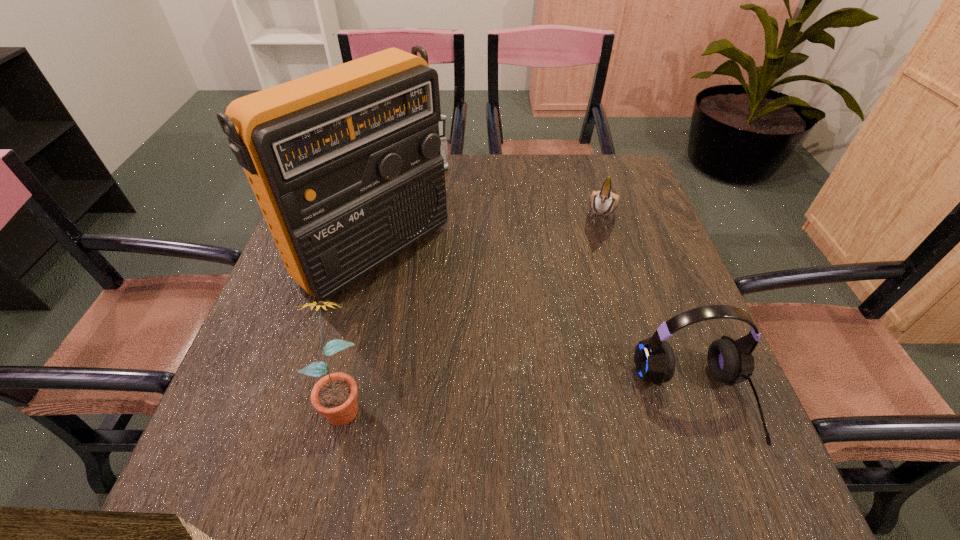
At what (x,y) coordinates should I click in order to perform the action: click on empty space that is in between the bird and the radio receiver. Please return your answer as a coordinate pair (x, y). This screenshot has height=540, width=960. Looking at the image, I should click on (487, 232).

This screenshot has height=540, width=960. I want to click on free point between the headset and the sunflower, so click(x=519, y=400).

Identify the location of empty location between the farthest object and the headset. (567, 286).

The width and height of the screenshot is (960, 540). What are the coordinates of `free space between the farthest object and the second tallest object` in the screenshot? It's located at (392, 285).

Where is `vacant area that lies between the bird and the headset`? vacant area that lies between the bird and the headset is located at coordinates coord(648,307).

Identify the location of free spot between the tallest object and the fourth shortest object. Image resolution: width=960 pixels, height=540 pixels. (359, 325).

This screenshot has width=960, height=540. Identify the location of free space between the sunflower and the bird. (472, 307).

Find the location of `object that can be found as the second closest to the tallest object`. object that can be found as the second closest to the tallest object is located at coordinates (334, 396).

Locate an element on the screen. object that is the second closest to the fourth shortest object is located at coordinates (730, 361).